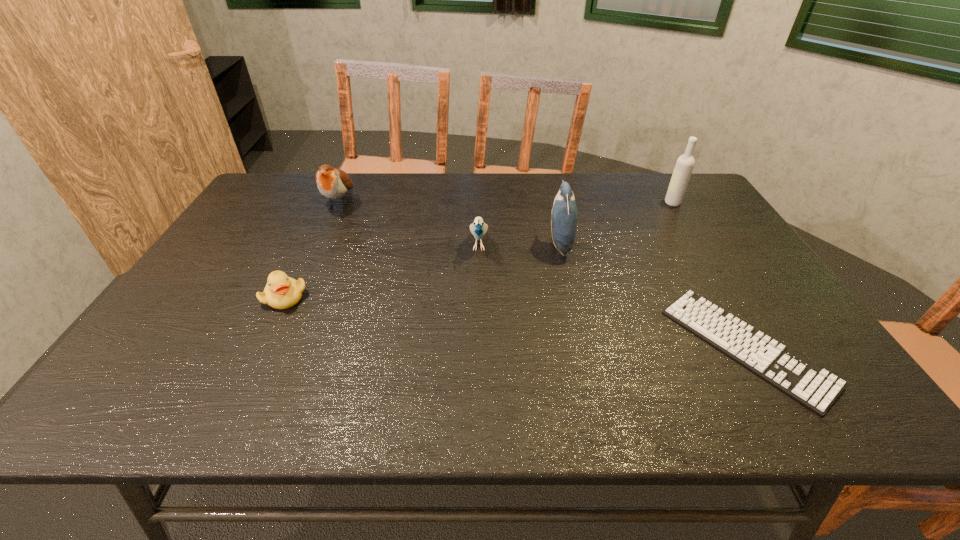
Locate an element on the screen. The width and height of the screenshot is (960, 540). vodka is located at coordinates (684, 166).

Locate an element on the screen. the rightmost bird is located at coordinates (564, 212).

Image resolution: width=960 pixels, height=540 pixels. I want to click on the farthest bird, so click(333, 183).

The width and height of the screenshot is (960, 540). What are the coordinates of `the third object from left to right` in the screenshot? It's located at pyautogui.click(x=478, y=228).

The width and height of the screenshot is (960, 540). Find the location of `the fourth tallest object`. the fourth tallest object is located at coordinates (478, 228).

You are a GUI agent. You are given a task and a screenshot of the screen. Output one action in this format:
    pyautogui.click(x=<x>, y=<y>)
    Task: Click on the second shortest object
    
    Given the screenshot: What is the action you would take?
    pyautogui.click(x=282, y=292)

Image resolution: width=960 pixels, height=540 pixels. I want to click on the shortest object, so click(815, 388).

The image size is (960, 540). What are the coordinates of `vacant region located 0.090m on the back of the vodka` in the screenshot? It's located at (661, 185).

Find the location of a particular element. blank space located at the tip of the third object from right to left's beak is located at coordinates (499, 245).

You are a GUI agent. You are given a task and a screenshot of the screen. Output one action in this format:
    pyautogui.click(x=<x>, y=<y>)
    Task: Click on the blank area located 0.280m at the tip of the third object from right to left's beak
    This screenshot has height=540, width=960.
    Given the screenshot: What is the action you would take?
    pyautogui.click(x=451, y=245)